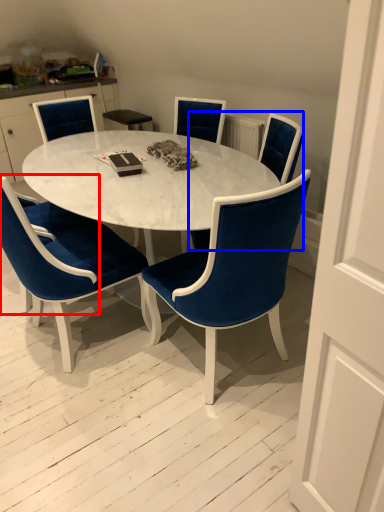
Question: Which point is further to the camera, armchair (highlighted by a red box) or chair (highlighted by a blue box)?

Choices:
 (A) armchair
 (B) chair

Answer: (A)